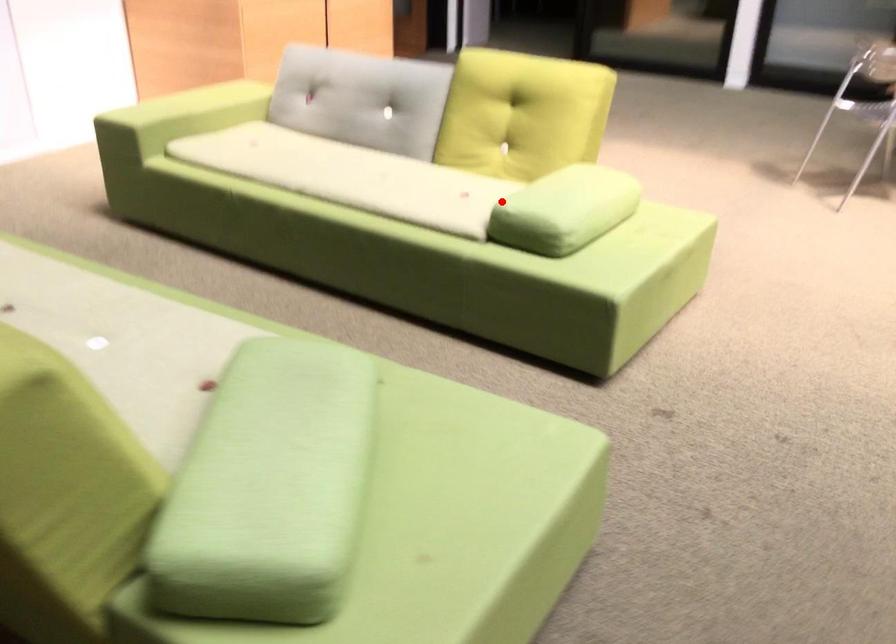
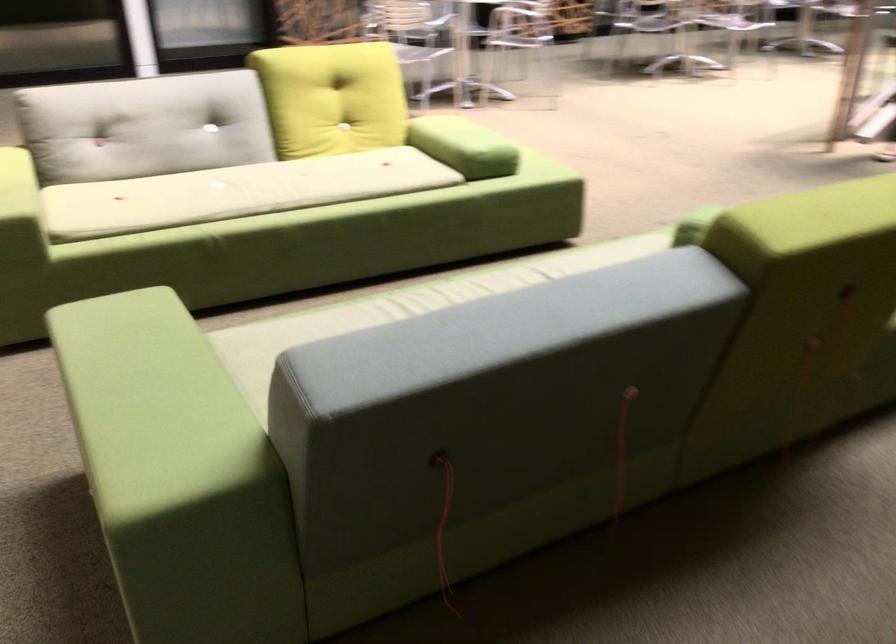
Question: A red point is marked in image1. In image2, is the corresponding 3D point closer to the camera or farther? Reply with the corresponding letter.

Choices:
 (A) The corresponding 3D point is closer.
 (B) The corresponding 3D point is farther.

Answer: (B)